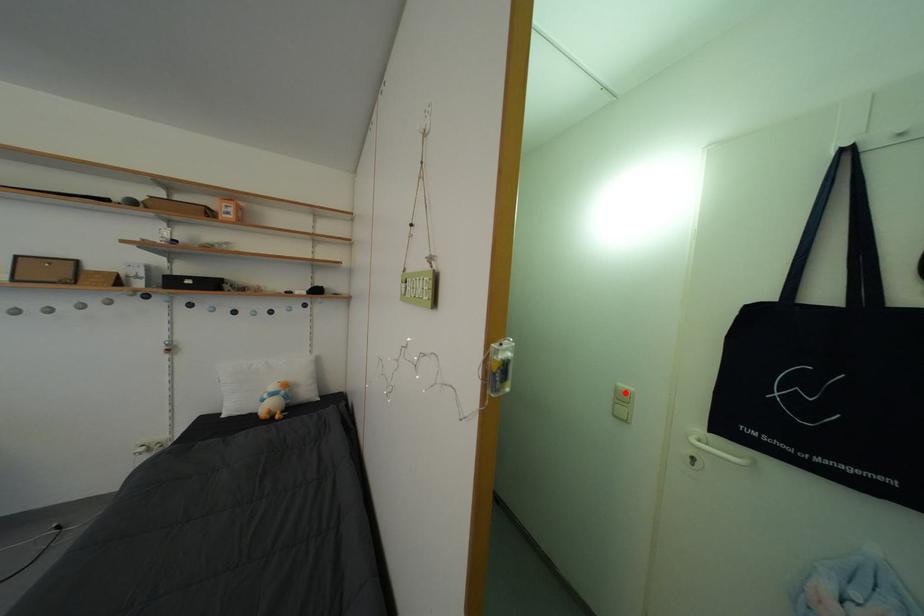
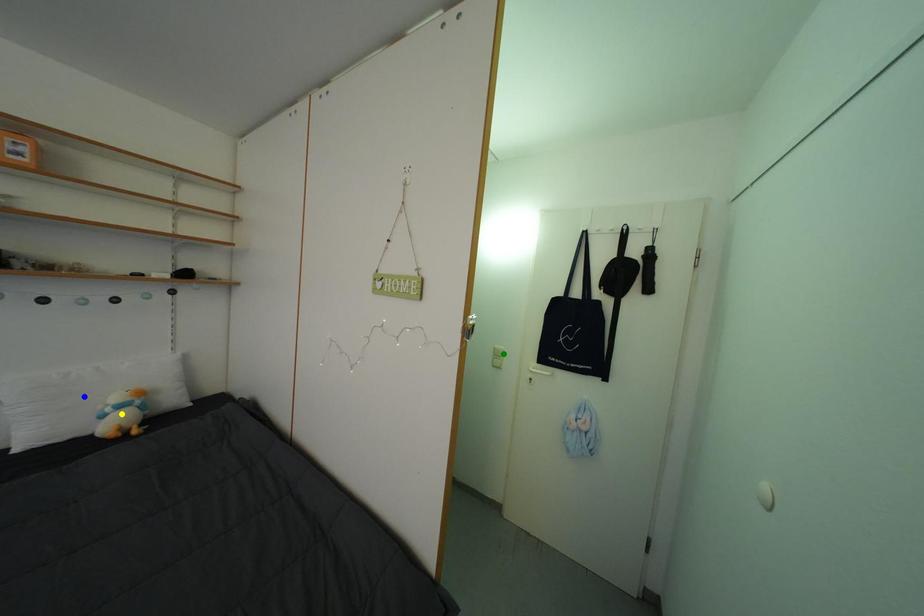
Question: I am providing you with two images of the same scene from different viewpoints. A red point is marked on the first image. You are given multiple points on the second image. Can you choose the point in image 2 that corresponds to the point in image 1?

Choices:
 (A) blue point
 (B) yellow point
 (C) green point

Answer: (C)